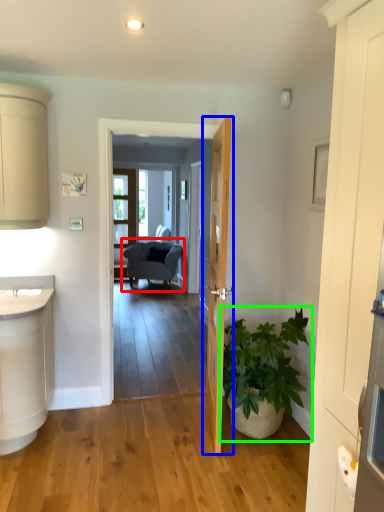
Question: Which object is positioned closest to chair (highlighted by a red box)? Select from door (highlighted by a blue box) and houseplant (highlighted by a green box).

Choices:
 (A) door
 (B) houseplant

Answer: (B)